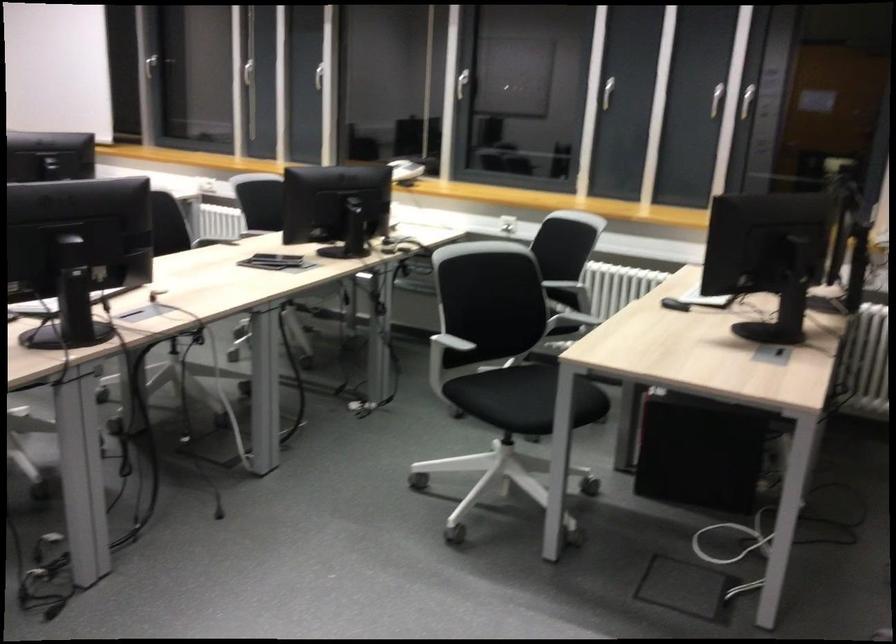
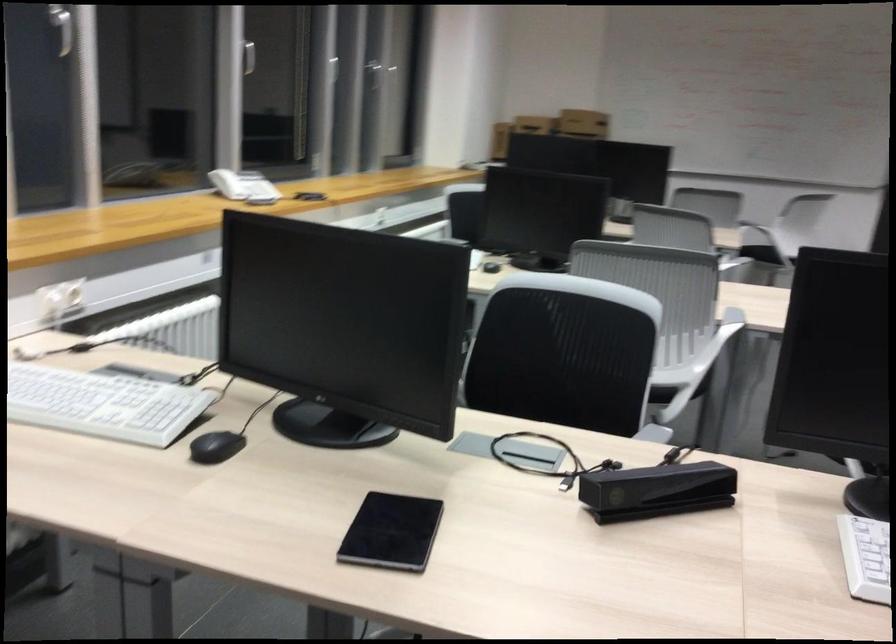
Question: I am providing you with two images of the same scene from different viewpoints. Please identify which objects are invisible in image2.

Choices:
 (A) chair sitting surface
 (B) white window handle
 (C) red striped pillow
 (D) black computer mouse

Answer: (B)